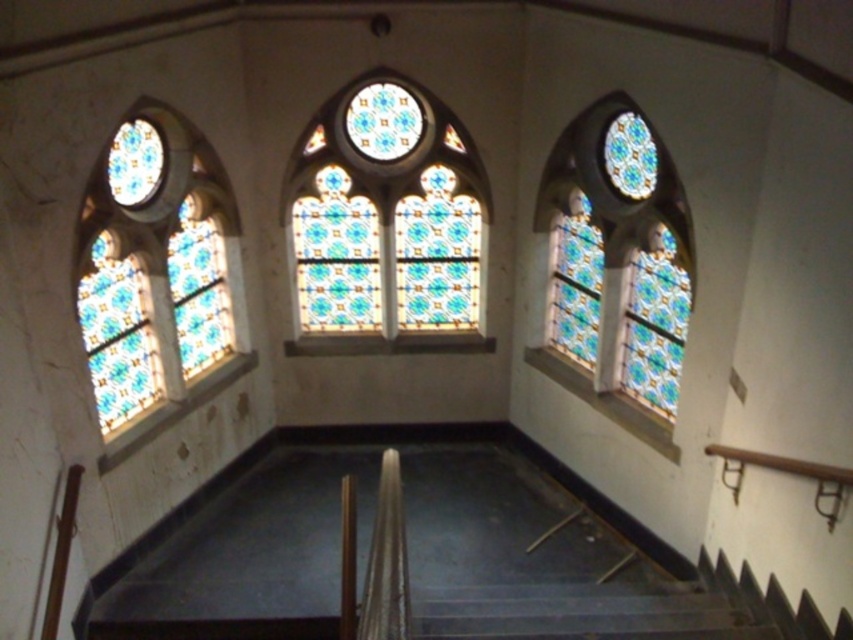
Question: Does stained glass at left appear on the right side of stained glass at right?

Choices:
 (A) yes
 (B) no

Answer: (B)

Question: Which point is farther to the camera?

Choices:
 (A) (606, 147)
 (B) (131, 156)

Answer: (A)

Question: Can you confirm if stained glass at left is thinner than stained glass at center?

Choices:
 (A) no
 (B) yes

Answer: (B)

Question: Where is stained glass at center located in relation to stained glass at right in the image?

Choices:
 (A) right
 (B) left

Answer: (B)

Question: Among these objects, which one is farthest from the camera?

Choices:
 (A) stained glass at right
 (B) stained glass at center

Answer: (B)

Question: Estimate the real-world distances between objects in this image. Which object is farther from the stained glass at left?

Choices:
 (A) stained glass at right
 (B) stained glass at center

Answer: (A)